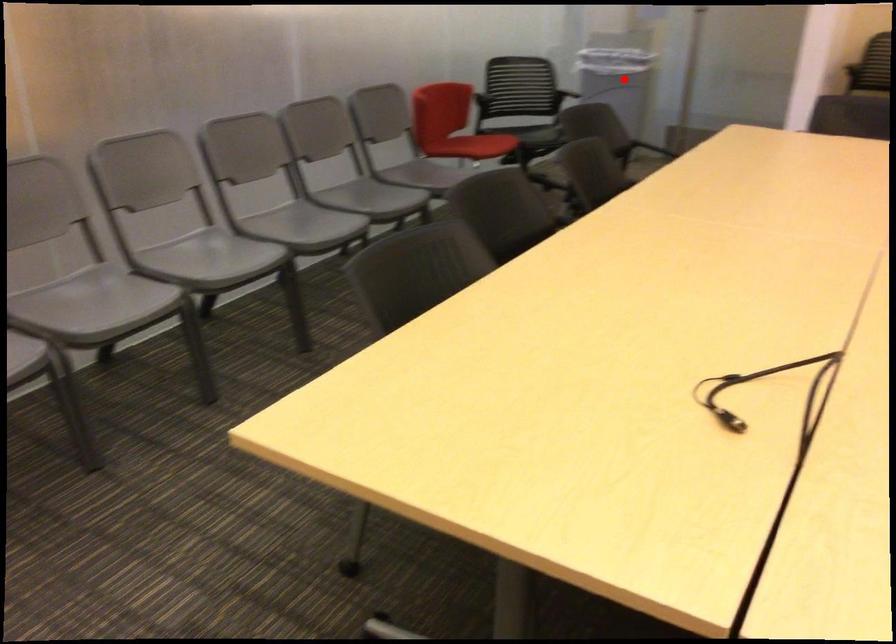
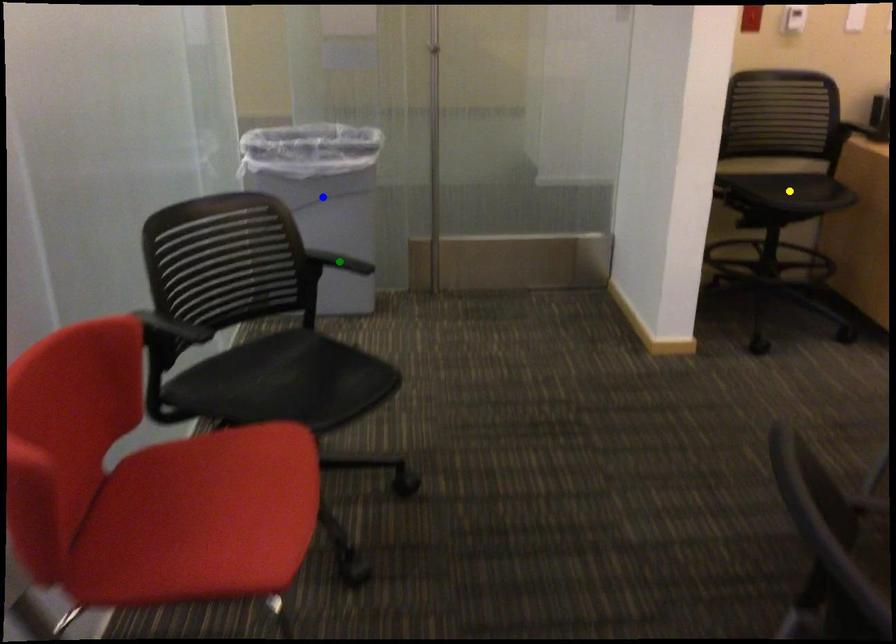
Question: I am providing you with two images of the same scene from different viewpoints. A red point is marked on the first image. You are given multiple points on the second image. Which point in image 2 represents the same 3d spot as the red point in image 1?

Choices:
 (A) blue point
 (B) yellow point
 (C) green point

Answer: (A)